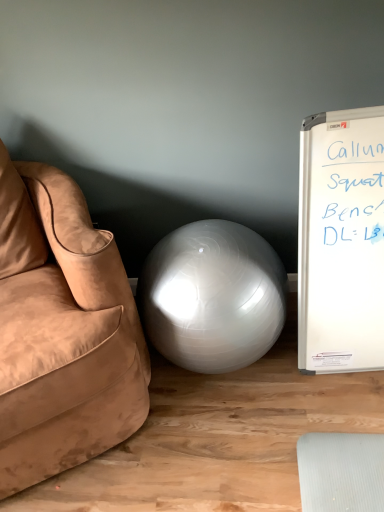
What do you see at coordinates (62, 331) in the screenshot?
I see `suede brown couch at left` at bounding box center [62, 331].

At what (x,y) coordinates should I click in order to perform the action: click on suede brown couch at left. Please return your answer as a coordinate pair (x, y). The width and height of the screenshot is (384, 512). Looking at the image, I should click on (62, 331).

Measure the distance between point (127, 364) and camera.

Point (127, 364) is 3.90 feet away from camera.

In order to click on satin white ball at center in this screenshot , I will do `click(213, 296)`.

In order to face satin white ball at center, should I rotate leftwards or rightwards?

Turn right approximately 3.328 degrees to face it.

What do you see at coordinates (213, 296) in the screenshot? I see `satin white ball at center` at bounding box center [213, 296].

The width and height of the screenshot is (384, 512). I want to click on suede brown couch at left, so click(62, 331).

Which is more to the left, suede brown couch at left or satin white ball at center?

suede brown couch at left is more to the left.

Which object is closer to the camera, suede brown couch at left or satin white ball at center?

suede brown couch at left is in front.

Considering the points (78, 343) and (250, 306), which point is behind, point (78, 343) or point (250, 306)?

Point (250, 306)

From the image's perspective, which one is positioned higher, suede brown couch at left or satin white ball at center?

suede brown couch at left, from the image's perspective.

From a real-world perspective, between suede brown couch at left and satin white ball at center, who is vertically higher?

In real-world perspective, suede brown couch at left is above.

Can you confirm if suede brown couch at left is thinner than satin white ball at center?

In fact, suede brown couch at left might be wider than satin white ball at center.

Which of these two, suede brown couch at left or satin white ball at center, stands taller?

suede brown couch at left.

Based on their sizes in the image, would you say suede brown couch at left is bigger or smaller than satin white ball at center?

Clearly, suede brown couch at left is larger in size than satin white ball at center.

Looking at this image, would you say satin white ball at center is part of suede brown couch at left's contents?

No, suede brown couch at left does not contain satin white ball at center.

Are suede brown couch at left and satin white ball at center making contact?

suede brown couch at left and satin white ball at center are clearly separated.

Is suede brown couch at left aimed at satin white ball at center?

No, suede brown couch at left is not oriented towards satin white ball at center.

Locate an element on the screen. studio couch lying on the left of satin white ball at center is located at coordinates (62, 331).

Is satin white ball at center at the right side of suede brown couch at left?

Yes.

Which object is more forward, satin white ball at center or suede brown couch at left?

suede brown couch at left is in front.

Considering the positions of points (263, 339) and (1, 354), is point (263, 339) closer to camera compared to point (1, 354)?

No, (263, 339) is further to viewer.

From the image's perspective, which is below, satin white ball at center or suede brown couch at left?

satin white ball at center, from the image's perspective.

From a real-world perspective, does satin white ball at center stand above suede brown couch at left?

Incorrect, from a real-world perspective, satin white ball at center is lower than suede brown couch at left.

Can you confirm if satin white ball at center is thinner than suede brown couch at left?

Indeed, satin white ball at center has a lesser width compared to suede brown couch at left.

Who is shorter, satin white ball at center or suede brown couch at left?

Standing shorter between the two is satin white ball at center.

Can you confirm if satin white ball at center is bigger than suede brown couch at left?

Incorrect, satin white ball at center is not larger than suede brown couch at left.

Is satin white ball at center inside or outside of suede brown couch at left?

satin white ball at center is not enclosed by suede brown couch at left.

Looking at this image, are satin white ball at center and suede brown couch at left making contact?

No, satin white ball at center is not next to suede brown couch at left.

Is satin white ball at center aimed at suede brown couch at left?

No, satin white ball at center does not turn towards suede brown couch at left.

Can you tell me how much satin white ball at center and suede brown couch at left differ in facing direction?

29 degrees.

In order to click on ball that is on the right side of suede brown couch at left in this screenshot , I will do `click(213, 296)`.

This screenshot has height=512, width=384. I want to click on studio couch in front of the satin white ball at center, so (62, 331).

The width and height of the screenshot is (384, 512). Find the location of `ball lying below the suede brown couch at left (from the image's perspective)`. ball lying below the suede brown couch at left (from the image's perspective) is located at coordinates (213, 296).